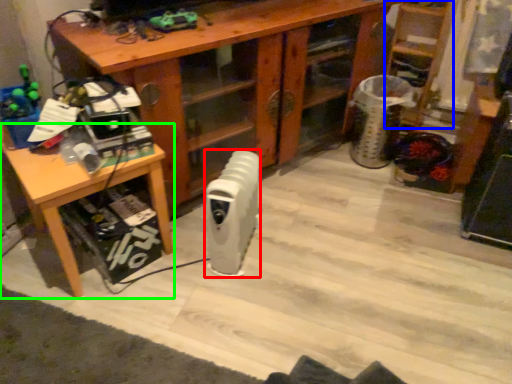
Question: Based on their relative distances, which object is farther from radiator (highlighted by a red box)? Choose from shelf (highlighted by a blue box) and table (highlighted by a green box).

Choices:
 (A) shelf
 (B) table

Answer: (A)